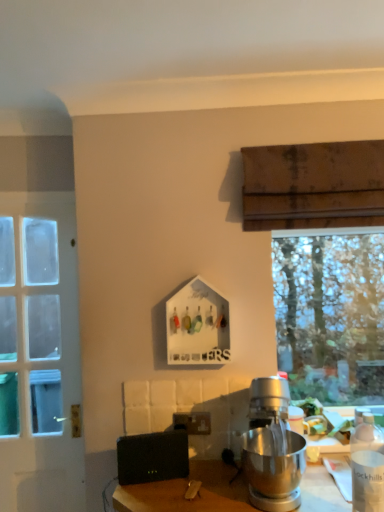
Question: From the image's perspective, is silver metallic stand mixer at center located beneath white matte bottle at lower right?

Choices:
 (A) yes
 (B) no

Answer: (B)

Question: Is silver metallic stand mixer at center touching white matte bottle at lower right?

Choices:
 (A) yes
 (B) no

Answer: (B)

Question: From the image's perspective, is silver metallic stand mixer at center on top of white matte bottle at lower right?

Choices:
 (A) yes
 (B) no

Answer: (A)

Question: Can you confirm if silver metallic stand mixer at center is smaller than white matte bottle at lower right?

Choices:
 (A) yes
 (B) no

Answer: (B)

Question: Can you confirm if silver metallic stand mixer at center is positioned to the right of white matte bottle at lower right?

Choices:
 (A) no
 (B) yes

Answer: (A)

Question: Relative to silver metallic stand mixer at center, is white glass door at left in front or behind?

Choices:
 (A) behind
 (B) front

Answer: (A)

Question: From a real-world perspective, relative to silver metallic stand mixer at center, is white glass door at left vertically above or below?

Choices:
 (A) above
 (B) below

Answer: (A)

Question: Is point (41, 459) positioned closer to the camera than point (286, 432)?

Choices:
 (A) farther
 (B) closer

Answer: (A)

Question: From the image's perspective, is white glass door at left located above or below silver metallic stand mixer at center?

Choices:
 (A) above
 (B) below

Answer: (A)

Question: From a real-world perspective, relative to white matte bottle at lower right, is black matte speaker at lower center vertically above or below?

Choices:
 (A) below
 (B) above

Answer: (A)

Question: Considering the positions of black matte speaker at lower center and white matte bottle at lower right in the image, is black matte speaker at lower center wider or thinner than white matte bottle at lower right?

Choices:
 (A) wide
 (B) thin

Answer: (B)

Question: From the image's perspective, is black matte speaker at lower center positioned above or below white matte bottle at lower right?

Choices:
 (A) below
 (B) above

Answer: (A)

Question: In the image, is black matte speaker at lower center positioned in front of or behind white matte bottle at lower right?

Choices:
 (A) front
 (B) behind

Answer: (B)

Question: Does point (259, 503) appear closer or farther from the camera than point (173, 425)?

Choices:
 (A) farther
 (B) closer

Answer: (B)

Question: Based on their positions, is silver metallic stand mixer at center located to the left or right of matte black power outlet at center?

Choices:
 (A) right
 (B) left

Answer: (A)